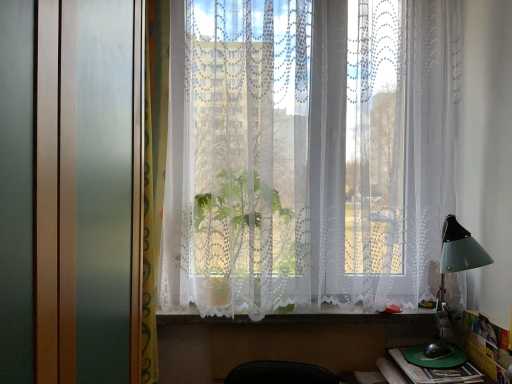
Question: From the image's perspective, is white lace curtains at center under green patterned curtain at left?

Choices:
 (A) yes
 (B) no

Answer: (B)

Question: From a real-world perspective, is white lace curtains at center located higher than green patterned curtain at left?

Choices:
 (A) no
 (B) yes

Answer: (B)

Question: Can you confirm if white lace curtains at center is taller than green patterned curtain at left?

Choices:
 (A) no
 (B) yes

Answer: (A)

Question: Can you see white lace curtains at center touching green patterned curtain at left?

Choices:
 (A) yes
 (B) no

Answer: (B)

Question: Is white lace curtains at center far from green patterned curtain at left?

Choices:
 (A) no
 (B) yes

Answer: (A)

Question: Is green patterned curtain at left situated inside green plastic book at lower right or outside?

Choices:
 (A) inside
 (B) outside

Answer: (B)

Question: In terms of width, does green patterned curtain at left look wider or thinner when compared to green plastic book at lower right?

Choices:
 (A) thin
 (B) wide

Answer: (A)

Question: Based on their sizes in the image, would you say green patterned curtain at left is bigger or smaller than green plastic book at lower right?

Choices:
 (A) big
 (B) small

Answer: (A)

Question: Considering their positions, is green patterned curtain at left located in front of or behind green plastic book at lower right?

Choices:
 (A) behind
 (B) front

Answer: (B)

Question: Is green plastic book at lower right wider or thinner than white lace curtain at lower center?

Choices:
 (A) wide
 (B) thin

Answer: (A)

Question: Is green plastic book at lower right to the left or to the right of white lace curtain at lower center in the image?

Choices:
 (A) left
 (B) right

Answer: (B)

Question: Looking at the image, does green plastic book at lower right seem bigger or smaller compared to white lace curtain at lower center?

Choices:
 (A) small
 (B) big

Answer: (A)

Question: Is green plastic book at lower right inside the boundaries of white lace curtain at lower center, or outside?

Choices:
 (A) outside
 (B) inside

Answer: (A)

Question: Is green plastic plate at lower right inside or outside of green patterned curtain at left?

Choices:
 (A) outside
 (B) inside

Answer: (A)

Question: From their relative heights in the image, would you say green plastic plate at lower right is taller or shorter than green patterned curtain at left?

Choices:
 (A) short
 (B) tall

Answer: (A)